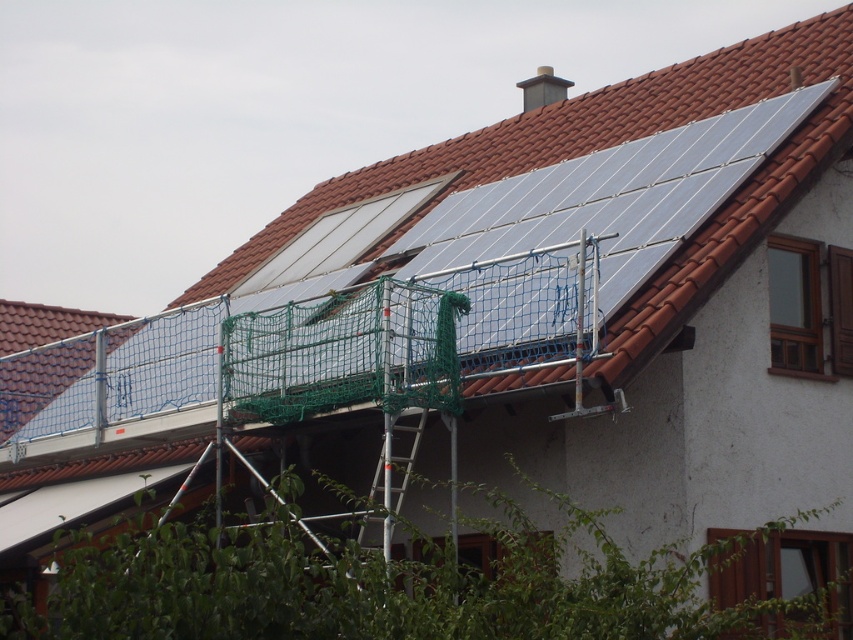
Question: Is metallic solar panels at upper center bigger than silver metallic ladder at center?

Choices:
 (A) no
 (B) yes

Answer: (B)

Question: Can you confirm if metallic solar panels at upper center is positioned above silver metallic ladder at center?

Choices:
 (A) yes
 (B) no

Answer: (A)

Question: Which point is farther to the camera?

Choices:
 (A) (622, 272)
 (B) (410, 426)

Answer: (B)

Question: Does metallic solar panels at upper center have a smaller size compared to silver metallic ladder at center?

Choices:
 (A) no
 (B) yes

Answer: (A)